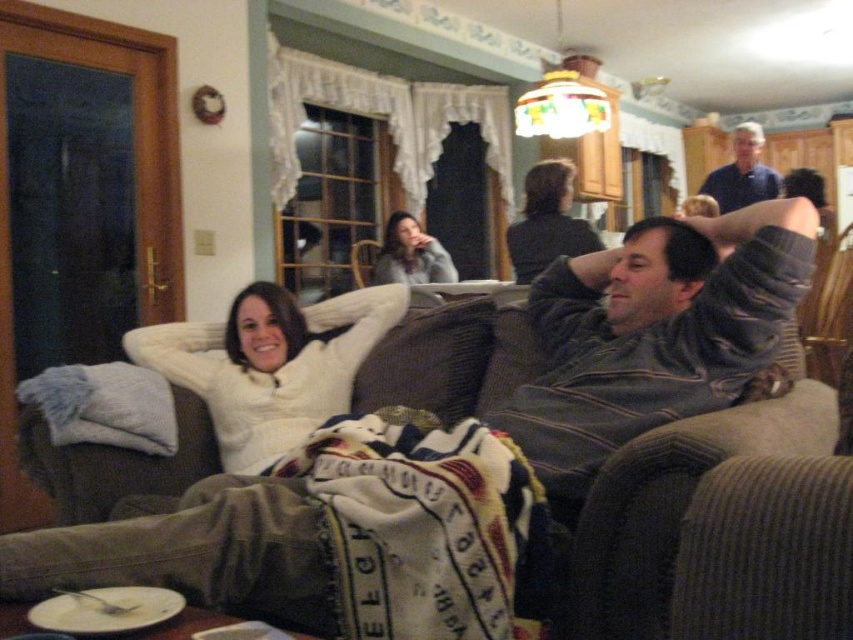
You are an interior designer analyzing the layout of this living room. You need to place a new decorative item exactly at the coordinates given for the gray striped sweater at center. What are the coordinates where you should place the new item?

The coordinates for the gray striped sweater at center are at point (x=654, y=333), so you should place the new decorative item at those coordinates.